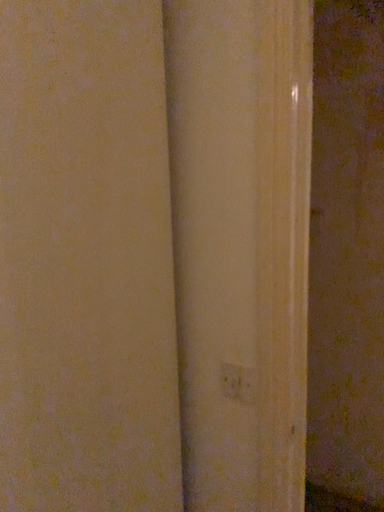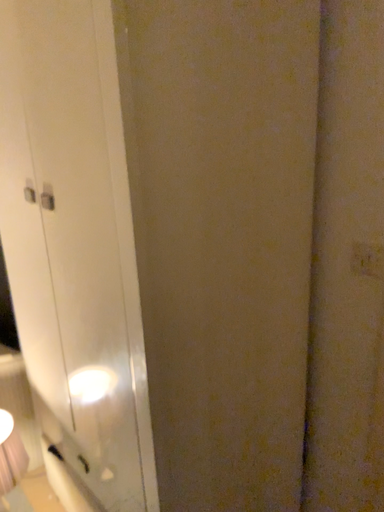
Question: How did the camera likely rotate when shooting the video?

Choices:
 (A) rotated upward
 (B) rotated downward

Answer: (B)